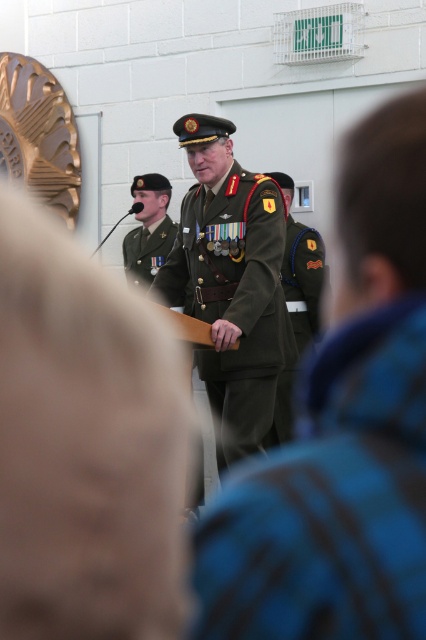
Is olive green fabric uniform at center shorter than olive green uniform at center?

In fact, olive green fabric uniform at center may be taller than olive green uniform at center.

Does olive green fabric uniform at center have a lesser width compared to olive green uniform at center?

No.

This screenshot has height=640, width=426. What do you see at coordinates (235, 300) in the screenshot? I see `olive green fabric uniform at center` at bounding box center [235, 300].

Locate an element on the screen. olive green fabric uniform at center is located at coordinates (235, 300).

Which is behind, point (307, 580) or point (143, 276)?

The point (143, 276) is more distant.

Which is in front, point (362, 316) or point (138, 243)?

Positioned in front is point (362, 316).

I want to click on green matte uniform at center, so click(x=330, y=499).

Is green fabric uniform at center thinner than olive green uniform at center?

Yes, green fabric uniform at center is thinner than olive green uniform at center.

Does green fabric uniform at center appear on the right side of olive green uniform at center?

Correct, you'll find green fabric uniform at center to the right of olive green uniform at center.

Where is `green fabric uniform at center`? The height and width of the screenshot is (640, 426). green fabric uniform at center is located at coordinates click(x=302, y=278).

Locate an element on the screen. green fabric uniform at center is located at coordinates (302, 278).